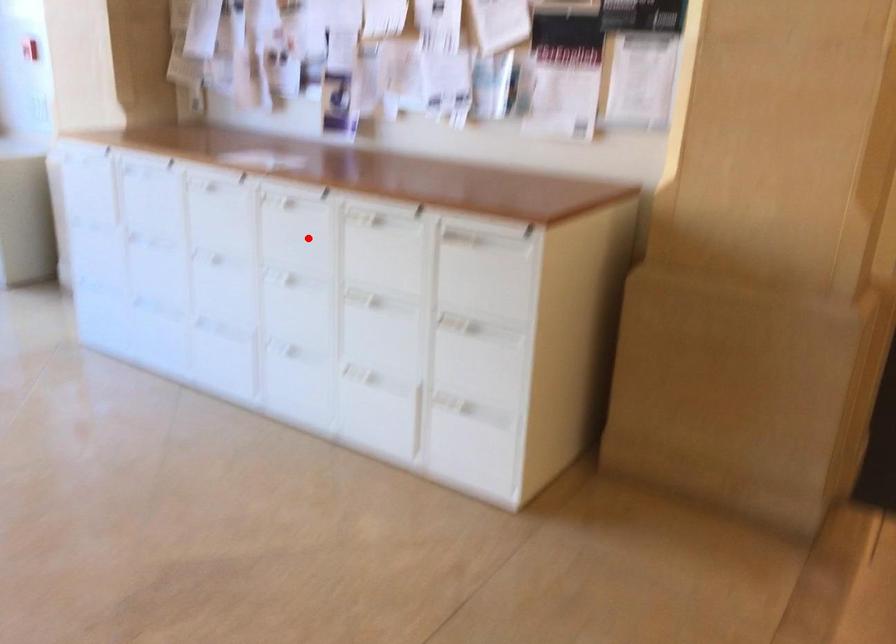
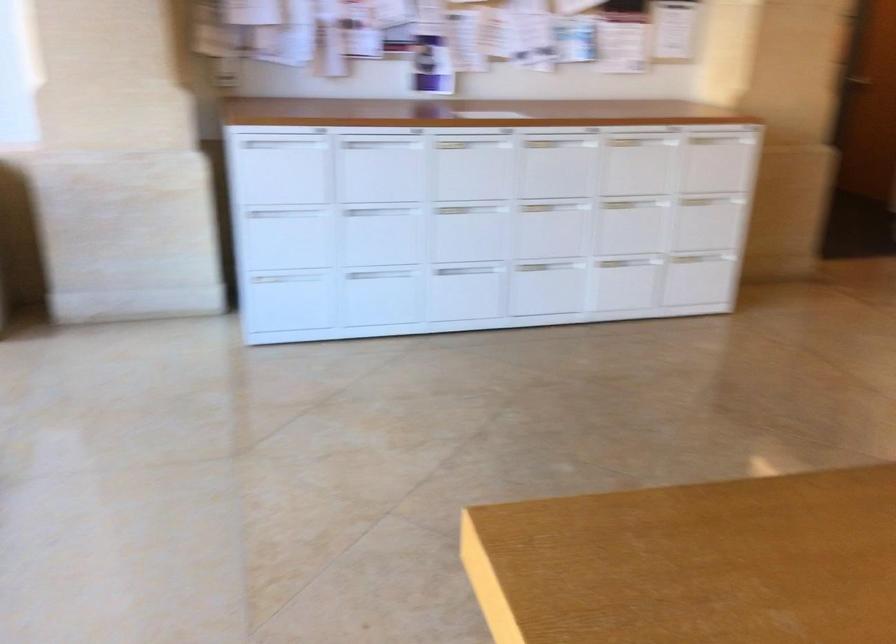
The point at the highlighted location is marked in the first image. Where is the corresponding point in the second image?

(556, 163)